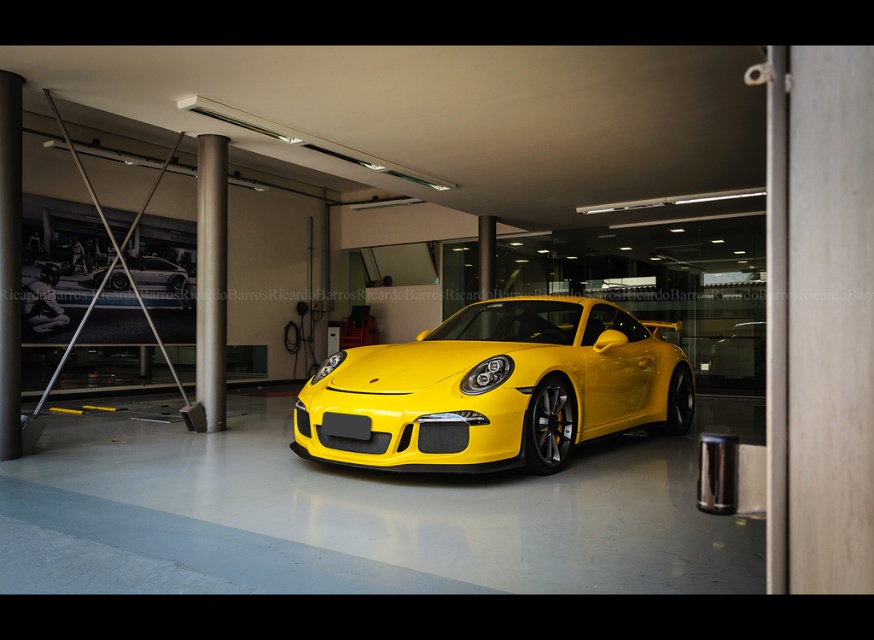
You are standing in the garage and want to place a small decoration between the two points, point (x=647, y=358) and point (x=147, y=257). Which point should the decoration be closer to in order to be nearer to you?

The decoration should be closer to point (x=647, y=358) because it is nearer to the viewer than point (x=147, y=257).

You are a delivery person trying to place a large package in the garage. The package is too big to fit anywhere else except the space between the glossy yellow sports car at center and the yellow glossy sports car at center. Is there enough space for the package?

The glossy yellow sports car at center is positioned under the yellow glossy sports car at center, meaning they are the same car. Therefore, there is no space between them to place the package.